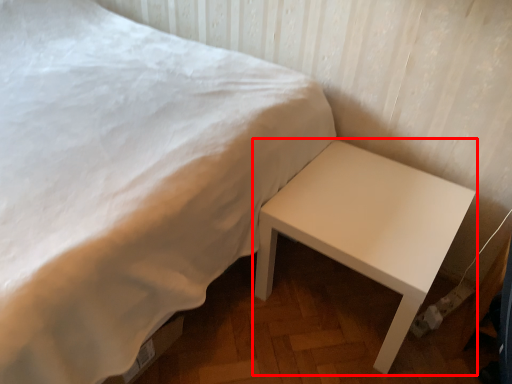
Question: From the image's perspective, considering the relative positions of table (annotated by the red box) and bed in the image provided, where is table (annotated by the red box) located with respect to the staircase?

Choices:
 (A) above
 (B) below

Answer: (B)